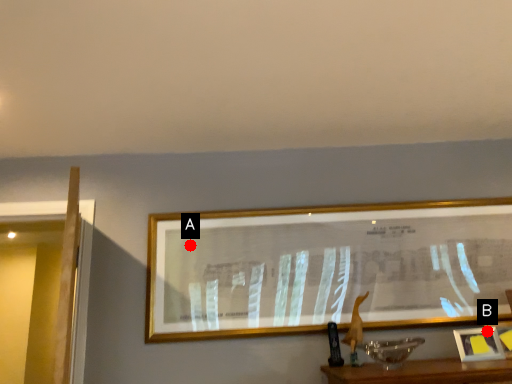
Question: Two points are circled on the image, labeled by A and B beside each circle. Which point is closer to the camera?

Choices:
 (A) A is closer
 (B) B is closer

Answer: (B)